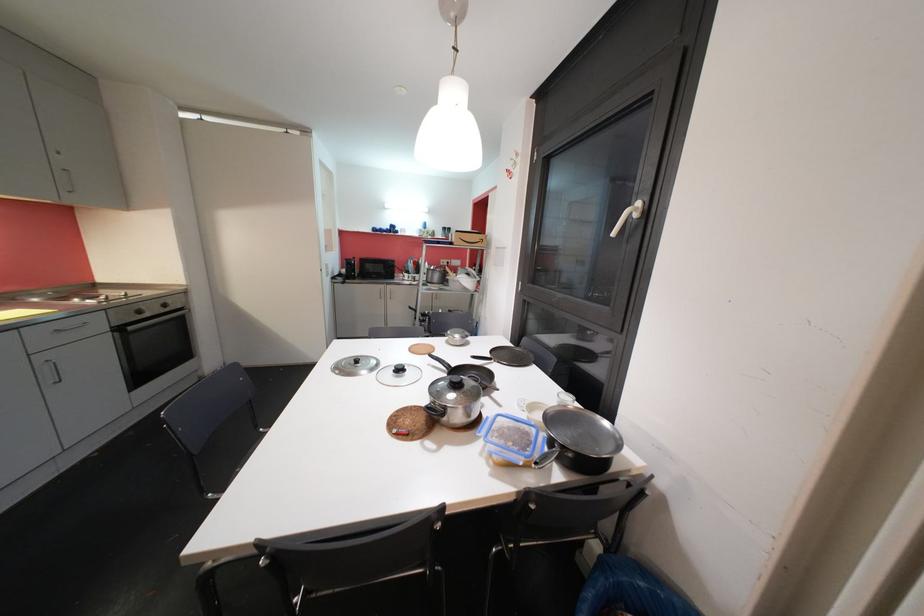
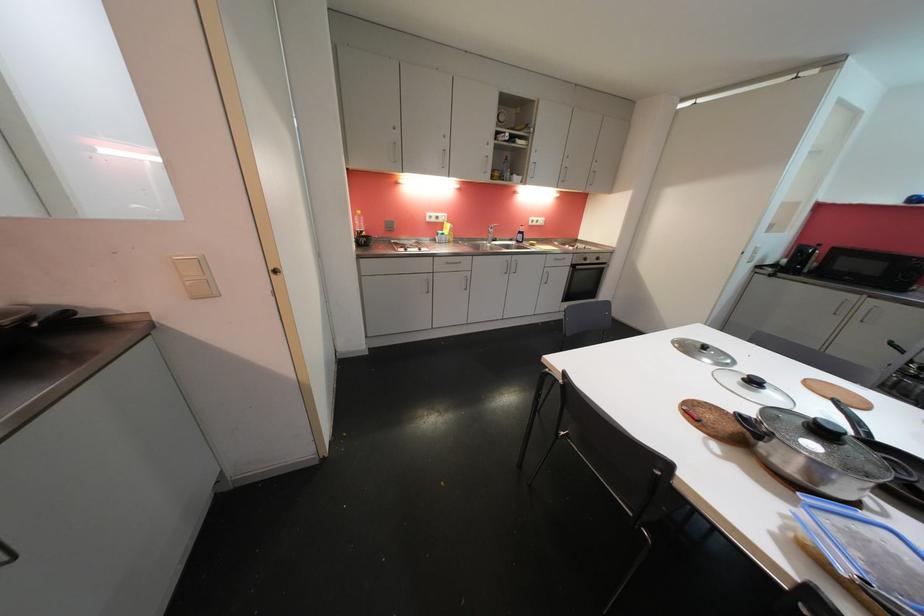
Where in the second image is the point corresponding to (405,371) from the first image?

(759, 385)